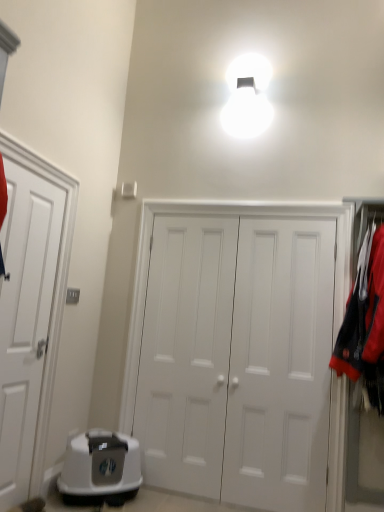
At what (x,y) coordinates should I click in order to perform the action: click on empty space that is ontop of white matte door at center, arranged as the first door when viewed from the right (from a real-world perspective). Please return your answer as a coordinate pair (x, y). The height and width of the screenshot is (512, 384). Looking at the image, I should click on point(248,198).